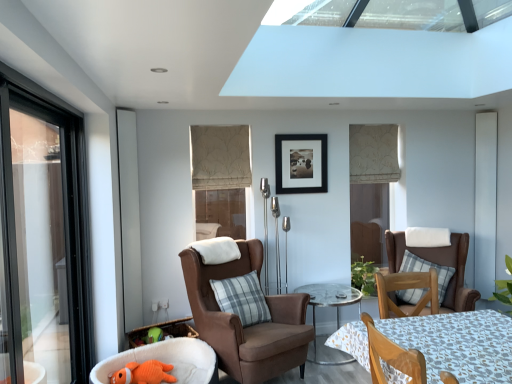
Question: Does orange plush toy at lower left come in front of wooden chair at lower right, the third chair viewed from the left?

Choices:
 (A) yes
 (B) no

Answer: (B)

Question: Is orange plush toy at lower left not within wooden chair at lower right, the third chair viewed from the left?

Choices:
 (A) no
 (B) yes

Answer: (B)

Question: Is orange plush toy at lower left to the left of wooden chair at lower right, which is the second chair from right to left, from the viewer's perspective?

Choices:
 (A) no
 (B) yes

Answer: (B)

Question: From the image's perspective, is orange plush toy at lower left over wooden chair at lower right, the third chair viewed from the left?

Choices:
 (A) no
 (B) yes

Answer: (A)

Question: Does orange plush toy at lower left appear on the right side of wooden chair at lower right, which is the second chair from right to left?

Choices:
 (A) yes
 (B) no

Answer: (B)

Question: From the image's perspective, is orange plush toy at lower left beneath wooden chair at lower right, which is the second chair from right to left?

Choices:
 (A) no
 (B) yes

Answer: (B)

Question: Is the surface of wooden chair at lower right, the third chair viewed from the left, in direct contact with orange plush toy at lower left?

Choices:
 (A) no
 (B) yes

Answer: (A)

Question: From the image's perspective, would you say wooden chair at lower right, which is the second chair from right to left, is positioned over orange plush toy at lower left?

Choices:
 (A) no
 (B) yes

Answer: (B)

Question: Can you confirm if wooden chair at lower right, which is the second chair from right to left, is taller than orange plush toy at lower left?

Choices:
 (A) no
 (B) yes

Answer: (B)

Question: Does wooden chair at lower right, which is the second chair from right to left, appear on the left side of orange plush toy at lower left?

Choices:
 (A) yes
 (B) no

Answer: (B)

Question: Can you confirm if wooden chair at lower right, the third chair viewed from the left, is bigger than orange plush toy at lower left?

Choices:
 (A) yes
 (B) no

Answer: (A)

Question: Considering the relative sizes of wooden chair at lower right, which is the second chair from right to left, and orange plush toy at lower left in the image provided, is wooden chair at lower right, which is the second chair from right to left, wider than orange plush toy at lower left?

Choices:
 (A) no
 (B) yes

Answer: (B)

Question: Is gray plaid pillow at center, the 1th pillow when ordered from front to back, outside orange plush toy at lower left?

Choices:
 (A) no
 (B) yes

Answer: (B)